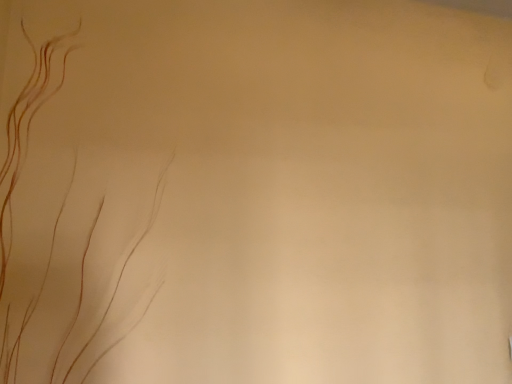
What do you see at coordinates (29, 302) in the screenshot?
I see `brown translucent vein at left` at bounding box center [29, 302].

At what (x,y) coordinates should I click in order to perform the action: click on brown translucent vein at left. Please return your answer as a coordinate pair (x, y). The height and width of the screenshot is (384, 512). Looking at the image, I should click on (29, 302).

What is the approximate height of brown translucent vein at left?

It is 20.75 inches.

This screenshot has width=512, height=384. What are the coordinates of `brown translucent vein at left` in the screenshot? It's located at pyautogui.click(x=29, y=302).